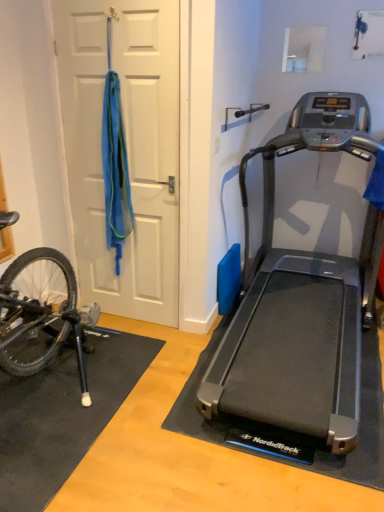
What do you see at coordinates (127, 149) in the screenshot? Image resolution: width=384 pixels, height=512 pixels. I see `white matte door at left` at bounding box center [127, 149].

This screenshot has width=384, height=512. What do you see at coordinates (62, 416) in the screenshot? I see `black rubber doormat at lower left` at bounding box center [62, 416].

In order to face silver metallic treadmill at right, should I rotate leftwards or rightwards?

It's best to rotate right around 15.270 degrees.

Identify the location of black matte bicycle at lower left. The width and height of the screenshot is (384, 512). (41, 314).

From their relative heights in the image, would you say silver metallic treadmill at right is taller or shorter than white matte door at left?

Clearly, silver metallic treadmill at right is shorter compared to white matte door at left.

Would you say silver metallic treadmill at right is to the left or to the right of white matte door at left in the picture?

silver metallic treadmill at right is positioned on white matte door at left's right side.

Is silver metallic treadmill at right thinner than white matte door at left?

No.

Is point (303, 268) positioned before point (10, 280)?

No, it is not.

From a real-world perspective, is silver metallic treadmill at right physically located above or below black matte bicycle at lower left?

From a real-world perspective, silver metallic treadmill at right is physically above black matte bicycle at lower left.

Locate an element on the screen. This screenshot has width=384, height=512. mountain bike lying on the left of silver metallic treadmill at right is located at coordinates (41, 314).

Is silver metallic treadmill at right positioned with its back to black matte bicycle at lower left?

No, silver metallic treadmill at right's orientation is not away from black matte bicycle at lower left.

Is black rubber doormat at lower left not close to black matte bicycle at lower left?

No.

Could black matte bicycle at lower left be considered to be inside black rubber doormat at lower left?

No, black matte bicycle at lower left is not surrounded by black rubber doormat at lower left.

Looking at this image, is black rubber doormat at lower left smaller than black matte bicycle at lower left?

Yes.

How far apart are black rubber doormat at lower left and silver metallic treadmill at right?

black rubber doormat at lower left and silver metallic treadmill at right are 33.20 inches apart.

From a real-world perspective, who is located higher, black rubber doormat at lower left or silver metallic treadmill at right?

silver metallic treadmill at right, from a real-world perspective.

Which of these two, black rubber doormat at lower left or silver metallic treadmill at right, stands taller?

With more height is silver metallic treadmill at right.

This screenshot has width=384, height=512. Find the location of `treadmill above the black rubber doormat at lower left (from the image's perspective)`. treadmill above the black rubber doormat at lower left (from the image's perspective) is located at coordinates (301, 302).

In terms of height, does white matte door at left look taller or shorter compared to silver metallic treadmill at right?

Considering their sizes, white matte door at left has more height than silver metallic treadmill at right.

From the image's perspective, which one is positioned lower, white matte door at left or silver metallic treadmill at right?

silver metallic treadmill at right is shown below in the image.

Can you confirm if white matte door at left is smaller than silver metallic treadmill at right?

Yes.

Find the location of `door lying above the silver metallic treadmill at right (from the image's perspective)`. door lying above the silver metallic treadmill at right (from the image's perspective) is located at coordinates (127, 149).

Considering the relative positions of silver metallic treadmill at right and black rubber doormat at lower left in the image provided, is silver metallic treadmill at right to the right of black rubber doormat at lower left from the viewer's perspective?

Correct, you'll find silver metallic treadmill at right to the right of black rubber doormat at lower left.

The width and height of the screenshot is (384, 512). I want to click on treadmill above the black rubber doormat at lower left (from the image's perspective), so click(x=301, y=302).

Is silver metallic treadmill at right oriented towards black rubber doormat at lower left?

No, silver metallic treadmill at right is not aimed at black rubber doormat at lower left.

Which is behind, point (298, 376) or point (25, 454)?

The point (298, 376) is farther.

Considering the relative sizes of black matte bicycle at lower left and white matte door at left in the image provided, is black matte bicycle at lower left shorter than white matte door at left?

Correct, black matte bicycle at lower left is not as tall as white matte door at left.

How many degrees apart are the facing directions of black matte bicycle at lower left and white matte door at left?

The angular difference between black matte bicycle at lower left and white matte door at left is 0.13 degrees.

Based on the photo, is black matte bicycle at lower left not within white matte door at left?

black matte bicycle at lower left is positioned outside white matte door at left.

From the image's perspective, which is above, black matte bicycle at lower left or white matte door at left?

white matte door at left.

I want to click on treadmill that is below the white matte door at left (from the image's perspective), so click(x=301, y=302).

Image resolution: width=384 pixels, height=512 pixels. I want to click on mountain bike below the silver metallic treadmill at right (from a real-world perspective), so click(x=41, y=314).

Which object lies further to the anchor point black matte bicycle at lower left, white matte door at left or black rubber doormat at lower left?

white matte door at left.

Based on the photo, considering their positions, is white matte door at left positioned further to black rubber doormat at lower left than black matte bicycle at lower left?

The object further to black rubber doormat at lower left is white matte door at left.

Considering their positions, is black matte bicycle at lower left positioned further to white matte door at left than silver metallic treadmill at right?

Based on the image, silver metallic treadmill at right appears to be further to white matte door at left.

Looking at the image, which one is located further to black matte bicycle at lower left, silver metallic treadmill at right or black rubber doormat at lower left?

silver metallic treadmill at right.

Consider the image. When comparing their distances from white matte door at left, does black matte bicycle at lower left or black rubber doormat at lower left seem closer?

The object closer to white matte door at left is black matte bicycle at lower left.

Looking at the image, which one is located closer to silver metallic treadmill at right, black matte bicycle at lower left or white matte door at left?

The object closer to silver metallic treadmill at right is black matte bicycle at lower left.

From the image, which object appears to be nearer to black rubber doormat at lower left, black matte bicycle at lower left or silver metallic treadmill at right?

black matte bicycle at lower left is closer to black rubber doormat at lower left.

Considering their positions, is black rubber doormat at lower left positioned closer to silver metallic treadmill at right than black matte bicycle at lower left?

black rubber doormat at lower left is positioned closer to the anchor silver metallic treadmill at right.

The height and width of the screenshot is (512, 384). I want to click on door between black rubber doormat at lower left and silver metallic treadmill at right from left to right, so click(127, 149).

Locate an element on the screen. The image size is (384, 512). door situated between black matte bicycle at lower left and silver metallic treadmill at right from left to right is located at coordinates (127, 149).

Image resolution: width=384 pixels, height=512 pixels. Identify the location of mountain bike located between black rubber doormat at lower left and silver metallic treadmill at right in the left-right direction. (41, 314).

The image size is (384, 512). Identify the location of mountain bike that lies between white matte door at left and black rubber doormat at lower left from top to bottom. (41, 314).